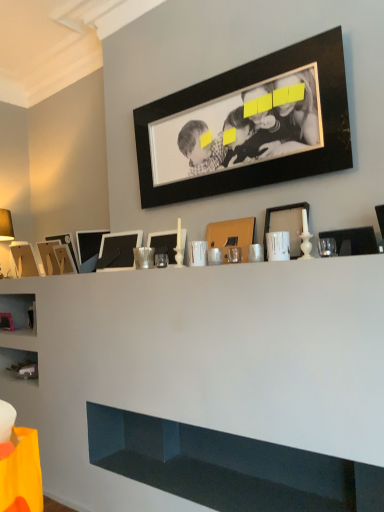
Based on the photo, what is the approximate width of matte gold table lamp at left?

The width of matte gold table lamp at left is 9.30 inches.

The image size is (384, 512). Find the location of `white glossy picture frame at center, marked as the 5th picture frame in a right-to-left arrangement`. white glossy picture frame at center, marked as the 5th picture frame in a right-to-left arrangement is located at coordinates (164, 243).

The width and height of the screenshot is (384, 512). What do you see at coordinates (118, 250) in the screenshot?
I see `black matte picture frame at center, which is the 6th picture frame in right-to-left order` at bounding box center [118, 250].

Where is `matte black picture frame at left, which is counted as the 8th picture frame, starting from the right`? The height and width of the screenshot is (512, 384). matte black picture frame at left, which is counted as the 8th picture frame, starting from the right is located at coordinates (65, 243).

How much space does matte black picture frame at right, the first picture frame viewed from the right, occupy vertically?

matte black picture frame at right, the first picture frame viewed from the right, is 12.50 centimeters tall.

What is the approximate width of matte cardboard picture frame at left, the 1th picture frame in the left-to-right sequence?

matte cardboard picture frame at left, the 1th picture frame in the left-to-right sequence, is 7.04 inches wide.

The width and height of the screenshot is (384, 512). I want to click on matte gold table lamp at left, so click(x=5, y=241).

Is white glossy picture frame at center, marked as the 5th picture frame in a right-to-left arrangement, shorter than wooden picture frame at left, acting as the ninth picture frame starting from the right?

Yes, white glossy picture frame at center, marked as the 5th picture frame in a right-to-left arrangement, is shorter than wooden picture frame at left, acting as the ninth picture frame starting from the right.

Considering the positions of objects white glossy picture frame at center, marked as the 5th picture frame in a right-to-left arrangement, and wooden picture frame at left, positioned as the 2th picture frame in left-to-right order, in the image provided, who is behind, white glossy picture frame at center, marked as the 5th picture frame in a right-to-left arrangement, or wooden picture frame at left, positioned as the 2th picture frame in left-to-right order,?

wooden picture frame at left, positioned as the 2th picture frame in left-to-right order, is more distant.

Is wooden picture frame at left, positioned as the 2th picture frame in left-to-right order, inside white glossy picture frame at center, marked as the 5th picture frame in a right-to-left arrangement?

Actually, wooden picture frame at left, positioned as the 2th picture frame in left-to-right order, is outside white glossy picture frame at center, marked as the 5th picture frame in a right-to-left arrangement.

How different are the orientations of matte black picture frame at right, the first picture frame viewed from the right, and wooden picture frame at left, positioned as the 2th picture frame in left-to-right order, in degrees?

The facing directions of matte black picture frame at right, the first picture frame viewed from the right, and wooden picture frame at left, positioned as the 2th picture frame in left-to-right order, are 14.6 degrees apart.

Measure the distance from matte black picture frame at right, marked as the tenth picture frame in a left-to-right arrangement, to wooden picture frame at left, positioned as the 2th picture frame in left-to-right order.

matte black picture frame at right, marked as the tenth picture frame in a left-to-right arrangement, is 2.06 meters from wooden picture frame at left, positioned as the 2th picture frame in left-to-right order.

Who is bigger, matte black picture frame at right, the first picture frame viewed from the right, or wooden picture frame at left, acting as the ninth picture frame starting from the right?

wooden picture frame at left, acting as the ninth picture frame starting from the right.

From the image's perspective, relative to wooden picture frame at left, acting as the ninth picture frame starting from the right, is matte black picture frame at right, the first picture frame viewed from the right, above or below?

matte black picture frame at right, the first picture frame viewed from the right, is situated higher than wooden picture frame at left, acting as the ninth picture frame starting from the right, in the image.

From a real-world perspective, which is physically above, white glossy picture frame at center, the 6th picture frame viewed from the left, or matte gold table lamp at left?

matte gold table lamp at left.

How different are the orientations of white glossy picture frame at center, the 6th picture frame viewed from the left, and matte gold table lamp at left in degrees?

The facing directions of white glossy picture frame at center, the 6th picture frame viewed from the left, and matte gold table lamp at left are 180 degrees apart.

Does white glossy picture frame at center, the 6th picture frame viewed from the left, have a greater height compared to matte gold table lamp at left?

In fact, white glossy picture frame at center, the 6th picture frame viewed from the left, may be shorter than matte gold table lamp at left.

From a real-world perspective, starting from the matte gold table lamp at left, which picture frame is the 7th one below it? Please provide its 2D coordinates.

[(164, 243)]

Is matte white picture frame at center, which is the second picture frame from right to left, not inside black matte picture frame at center, the 5th picture frame in the left-to-right sequence?

Yes, matte white picture frame at center, which is the second picture frame from right to left, is outside of black matte picture frame at center, the 5th picture frame in the left-to-right sequence.

Considering the relative sizes of matte white picture frame at center, the 9th picture frame when ordered from left to right, and black matte picture frame at center, the 5th picture frame in the left-to-right sequence, in the image provided, is matte white picture frame at center, the 9th picture frame when ordered from left to right, bigger than black matte picture frame at center, the 5th picture frame in the left-to-right sequence,?

No, matte white picture frame at center, the 9th picture frame when ordered from left to right, is not bigger than black matte picture frame at center, the 5th picture frame in the left-to-right sequence.

Can you confirm if matte white picture frame at center, which is the second picture frame from right to left, is positioned to the left of black matte picture frame at center, which is the 6th picture frame in right-to-left order?

Incorrect, matte white picture frame at center, which is the second picture frame from right to left, is not on the left side of black matte picture frame at center, which is the 6th picture frame in right-to-left order.

Locate an element on the screen. the 5th picture frame above the matte black picture frame at right, the first picture frame viewed from the right (from a real-world perspective) is located at coordinates (24, 259).

Is point (12, 246) closer or farther from the camera than point (354, 237)?

Point (12, 246) is farther from the camera than point (354, 237).

Is matte cardboard picture frame at left, marked as the tenth picture frame in a right-to-left arrangement, beside matte black picture frame at right, the first picture frame viewed from the right?

No, matte cardboard picture frame at left, marked as the tenth picture frame in a right-to-left arrangement, is not with matte black picture frame at right, the first picture frame viewed from the right.

Based on the photo, from the image's perspective, is matte cardboard picture frame at left, marked as the tenth picture frame in a right-to-left arrangement, positioned above or below matte black picture frame at right, the first picture frame viewed from the right?

From the image's perspective, matte cardboard picture frame at left, marked as the tenth picture frame in a right-to-left arrangement, appears below matte black picture frame at right, the first picture frame viewed from the right.

From the image's perspective, which is below, white glossy picture frame at center, the 6th picture frame viewed from the left, or white glossy cabinet at lower center?

white glossy cabinet at lower center appears lower in the image.

From a real-world perspective, which object stands above the other?

white glossy picture frame at center, the 6th picture frame viewed from the left, from a real-world perspective.

In the scene shown: Which object is further away from the camera, white glossy picture frame at center, marked as the 5th picture frame in a right-to-left arrangement, or white glossy cabinet at lower center?

white glossy picture frame at center, marked as the 5th picture frame in a right-to-left arrangement, is further from the camera.

Based on the photo, considering the sizes of objects white glossy picture frame at center, the 6th picture frame viewed from the left, and white glossy cabinet at lower center in the image provided, who is wider, white glossy picture frame at center, the 6th picture frame viewed from the left, or white glossy cabinet at lower center?

white glossy cabinet at lower center is wider.

Where is `the 5th picture frame to the right of the matte black picture frame at left, which is the third picture frame from left to right, counting from the anchor's position`? Image resolution: width=384 pixels, height=512 pixels. the 5th picture frame to the right of the matte black picture frame at left, which is the third picture frame from left to right, counting from the anchor's position is located at coordinates (232, 236).

Is matte brown picture frame at center, marked as the eighth picture frame in a left-to-right arrangement, directly adjacent to matte black picture frame at left, which is counted as the 8th picture frame, starting from the right?

There is a gap between matte brown picture frame at center, marked as the eighth picture frame in a left-to-right arrangement, and matte black picture frame at left, which is counted as the 8th picture frame, starting from the right.

From the picture: How different are the orientations of matte brown picture frame at center, the 3th picture frame viewed from the right, and matte black picture frame at left, which is counted as the 8th picture frame, starting from the right, in degrees?

The angular difference between matte brown picture frame at center, the 3th picture frame viewed from the right, and matte black picture frame at left, which is counted as the 8th picture frame, starting from the right, is 2.6 degrees.

From the image's perspective, is matte brown picture frame at center, the 3th picture frame viewed from the right, beneath matte black picture frame at left, which is the third picture frame from left to right?

No, from the image's perspective, matte brown picture frame at center, the 3th picture frame viewed from the right, is not below matte black picture frame at left, which is the third picture frame from left to right.

The image size is (384, 512). In order to click on the 4th picture frame counting from the right side of the wooden picture frame at left, acting as the ninth picture frame starting from the right in this screenshot , I will do `click(164, 243)`.

Locate an element on the screen. The width and height of the screenshot is (384, 512). picture frame that is the 8th object located in front of the wooden picture frame at left, positioned as the 2th picture frame in left-to-right order is located at coordinates (354, 239).

Based on their spatial positions, is white glossy cabinet at lower center or matte gold table lamp at left further from matte black picture frame at right, the first picture frame viewed from the right?

matte gold table lamp at left.

Which object lies further to the anchor point matte black picture frame at left, which is the 4th picture frame from left to right, matte black picture frame at right, marked as the tenth picture frame in a left-to-right arrangement, or white glossy cabinet at lower center?

Based on the image, matte black picture frame at right, marked as the tenth picture frame in a left-to-right arrangement, appears to be further to matte black picture frame at left, which is the 4th picture frame from left to right.

Estimate the real-world distances between objects in this image. Which object is closer to matte black picture frame at right, the first picture frame viewed from the right, white glossy picture frame at center, marked as the 5th picture frame in a right-to-left arrangement, or matte white picture frame at center, the 9th picture frame when ordered from left to right?

Among the two, matte white picture frame at center, the 9th picture frame when ordered from left to right, is located nearer to matte black picture frame at right, the first picture frame viewed from the right.

Based on their spatial positions, is matte brown picture frame at center, marked as the eighth picture frame in a left-to-right arrangement, or wooden picture frame at left, acting as the ninth picture frame starting from the right, further from white glossy cabinet at lower center?

wooden picture frame at left, acting as the ninth picture frame starting from the right, is positioned further to the anchor white glossy cabinet at lower center.

Looking at the image, which one is located further to matte black picture frame at left, which is counted as the 8th picture frame, starting from the right, black matte picture frame at upper center, marked as the seventh picture frame in a left-to-right arrangement, or black matte picture frame at center, the 5th picture frame in the left-to-right sequence?

Based on the image, black matte picture frame at upper center, marked as the seventh picture frame in a left-to-right arrangement, appears to be further to matte black picture frame at left, which is counted as the 8th picture frame, starting from the right.

Which object lies nearer to the anchor point black matte picture frame at upper center, placed as the 4th picture frame when sorted from right to left, matte cardboard picture frame at left, the 1th picture frame in the left-to-right sequence, or white glossy cabinet at lower center?

The object closer to black matte picture frame at upper center, placed as the 4th picture frame when sorted from right to left, is white glossy cabinet at lower center.

Looking at the image, which one is located further to matte black picture frame at left, which is the third picture frame from left to right, matte brown picture frame at center, marked as the eighth picture frame in a left-to-right arrangement, or white glossy cabinet at lower center?

Based on the image, white glossy cabinet at lower center appears to be further to matte black picture frame at left, which is the third picture frame from left to right.

When comparing their distances from matte black picture frame at left, which is counted as the 8th picture frame, starting from the right, does matte brown picture frame at center, the 3th picture frame viewed from the right, or wooden picture frame at left, acting as the ninth picture frame starting from the right, seem further?

matte brown picture frame at center, the 3th picture frame viewed from the right, is further to matte black picture frame at left, which is counted as the 8th picture frame, starting from the right.

At what (x,y) coordinates should I click in order to perform the action: click on cabinet situated between matte gold table lamp at left and matte brown picture frame at center, the 3th picture frame viewed from the right, from left to right. Please return your answer as a coordinate pair (x, y). The height and width of the screenshot is (512, 384). Looking at the image, I should click on (228, 467).

At what (x,y) coordinates should I click in order to perform the action: click on picture frame between matte cardboard picture frame at left, the 1th picture frame in the left-to-right sequence, and matte black picture frame at left, which is counted as the 8th picture frame, starting from the right. Please return your answer as a coordinate pair (x, y). This screenshot has height=512, width=384. Looking at the image, I should click on (49, 257).

At what (x,y) coordinates should I click in order to perform the action: click on picture frame located between matte black picture frame at left, which is the third picture frame from left to right, and black matte picture frame at center, the 5th picture frame in the left-to-right sequence, in the left-right direction. Please return your answer as a coordinate pair (x, y). Looking at the image, I should click on (89, 249).

Locate an element on the screen. The height and width of the screenshot is (512, 384). picture frame between wooden picture frame at left, acting as the ninth picture frame starting from the right, and matte black picture frame at left, which is the 4th picture frame from left to right, in the horizontal direction is located at coordinates (65, 243).